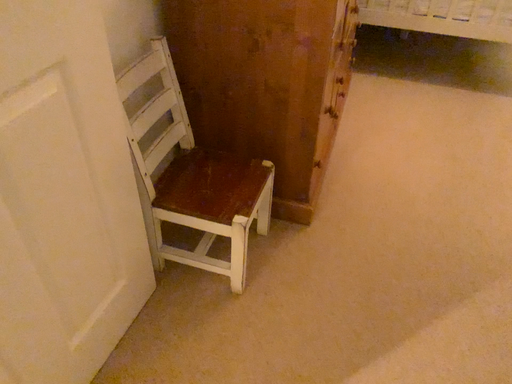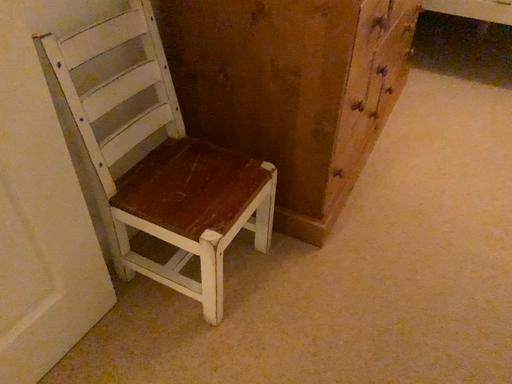
Question: Which way did the camera rotate in the video?

Choices:
 (A) rotated right
 (B) rotated left

Answer: (B)